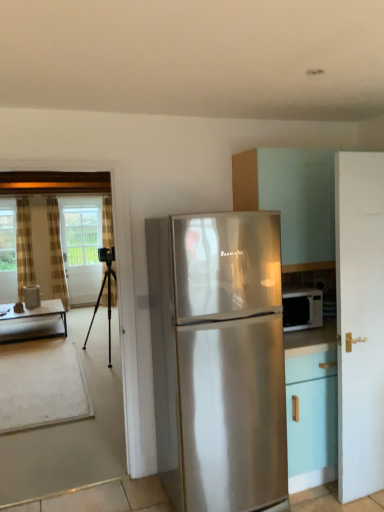
What do you see at coordinates (218, 358) in the screenshot? The width and height of the screenshot is (384, 512). I see `satin silver refrigerator at center` at bounding box center [218, 358].

Measure the distance between point (233, 203) and camera.

2.77 meters.

The height and width of the screenshot is (512, 384). Describe the element at coordinates (360, 321) in the screenshot. I see `white matte door at right` at that location.

This screenshot has height=512, width=384. I want to click on satin silver refrigerator at center, so point(218,358).

Looking at this image, in terms of width, does white glossy water at left look wider or thinner when compared to plaid fabric curtain at left, which ranks as the third curtain in left-to-right order?

Clearly, white glossy water at left has more width compared to plaid fabric curtain at left, which ranks as the third curtain in left-to-right order.

Consider the image. From a real-world perspective, between white glossy water at left and plaid fabric curtain at left, which ranks as the third curtain in left-to-right order, who is vertically higher?

From a 3D spatial view, plaid fabric curtain at left, which ranks as the third curtain in left-to-right order, is above.

Which of these two, white glossy water at left or plaid fabric curtain at left, which ranks as the third curtain in left-to-right order, is smaller?

white glossy water at left is smaller.

Locate an element on the screen. the 1st curtain above the white glossy water at left (from the image's perspective) is located at coordinates tap(107, 223).

Does wooden table at left have a larger size compared to black glossy microwave oven at right?

Yes, wooden table at left is bigger than black glossy microwave oven at right.

Could black glossy microwave oven at right be considered to be inside wooden table at left?

No, black glossy microwave oven at right is not a part of wooden table at left.

Is wooden table at left thinner than black glossy microwave oven at right?

In fact, wooden table at left might be wider than black glossy microwave oven at right.

From the image's perspective, does wooden table at left appear higher than black glossy microwave oven at right?

No.

Is black metal tripod at left beside black glossy microwave oven at right?

No, black metal tripod at left is not in contact with black glossy microwave oven at right.

Does point (110, 306) appear closer or farther from the camera than point (293, 296)?

Point (110, 306).

Between black metal tripod at left and black glossy microwave oven at right, which one has less height?

With less height is black glossy microwave oven at right.

Based on their positions, is black metal tripod at left located to the left or right of black glossy microwave oven at right?

Based on their positions, black metal tripod at left is located to the left of black glossy microwave oven at right.

Which of these two, white glass screen door at left or wooden table at left, stands shorter?

With less height is wooden table at left.

Is white glass screen door at left oriented away from wooden table at left?

No, white glass screen door at left is not facing away from wooden table at left.

From a real-world perspective, is white glass screen door at left physically located above or below wooden table at left?

white glass screen door at left is situated higher than wooden table at left in the real world.

Considering the relative positions of white glass screen door at left and wooden table at left in the image provided, is white glass screen door at left behind wooden table at left?

Yes, white glass screen door at left is further from the viewer.

Between white glass screen door at left and satin silver refrigerator at center, which one has smaller width?

Thinner between the two is white glass screen door at left.

Are white glass screen door at left and satin silver refrigerator at center located far from each other?

Yes.

In the scene shown: Visually, is white glass screen door at left positioned to the left or to the right of satin silver refrigerator at center?

In the image, white glass screen door at left appears on the left side of satin silver refrigerator at center.

Considering the sizes of objects white glass screen door at left and satin silver refrigerator at center in the image provided, who is taller, white glass screen door at left or satin silver refrigerator at center?

white glass screen door at left is taller.

Does point (290, 303) lie in front of point (114, 300)?

Yes, it is in front of point (114, 300).

Based on the photo, which object is wider, black glossy microwave oven at right or plaid fabric curtain at left, the first curtain positioned from the right?

Wider between the two is black glossy microwave oven at right.

Is black glossy microwave oven at right not within plaid fabric curtain at left, which ranks as the third curtain in left-to-right order?

That's correct, black glossy microwave oven at right is outside of plaid fabric curtain at left, which ranks as the third curtain in left-to-right order.

Are black glossy microwave oven at right and plaid fabric curtain at left, which ranks as the third curtain in left-to-right order, beside each other?

No, black glossy microwave oven at right is not with plaid fabric curtain at left, which ranks as the third curtain in left-to-right order.

Is point (43, 320) farther from camera compared to point (252, 202)?

Yes, point (43, 320) is behind point (252, 202).

Is wooden table at left turned away from white glossy cabinet at upper right?

wooden table at left is not turned away from white glossy cabinet at upper right.

Find the location of `table lying below the white glossy cabinet at upper right (from the image's perspective)`. table lying below the white glossy cabinet at upper right (from the image's perspective) is located at coordinates (33, 322).

At what (x,y) coordinates should I click in order to perform the action: click on the 1st curtain above the white glossy water at left (from the image's perspective). Please return your answer as a coordinate pair (x, y). The height and width of the screenshot is (512, 384). Looking at the image, I should click on (107, 223).

Where is `table behind the black glossy microwave oven at right`? This screenshot has height=512, width=384. table behind the black glossy microwave oven at right is located at coordinates (33, 322).

Based on their spatial positions, is white matte door at right or white glossy water at left further from black metal tripod at left?

white matte door at right is further to black metal tripod at left.

Estimate the real-world distances between objects in this image. Which object is further from white glossy water at left, white glossy cabinet at upper right or satin silver refrigerator at center?

white glossy cabinet at upper right.

When comparing their distances from plaid fabric curtain at left, the first curtain positioned from the right, does striped fabric curtain at left, acting as the first curtain starting from the left, or white matte door at right seem closer?

striped fabric curtain at left, acting as the first curtain starting from the left.

Which object lies further to the anchor point white glossy water at left, black glossy microwave oven at right or white matte door at right?

white matte door at right.

Looking at the image, which one is located closer to white glossy cabinet at upper right, plaid fabric curtain at left, the first curtain positioned from the right, or striped fabric curtain at left, which is the third curtain in right-to-left order?

plaid fabric curtain at left, the first curtain positioned from the right.

Estimate the real-world distances between objects in this image. Which object is closer to white matte door at right, white glossy water at left or striped fabric curtain at left, acting as the first curtain starting from the left?

white glossy water at left is positioned closer to the anchor white matte door at right.

Based on their spatial positions, is striped fabric curtain at left, which is the third curtain in right-to-left order, or wooden table at left closer to black metal tripod at left?

Based on the image, wooden table at left appears to be nearer to black metal tripod at left.

From the image, which object appears to be farther from satin silver refrigerator at center, white matte door at right or white glass screen door at left?

white glass screen door at left is positioned further to the anchor satin silver refrigerator at center.

The height and width of the screenshot is (512, 384). What are the coordinates of `appliance between black metal tripod at left and plaid fabric curtain at left, the first curtain positioned from the right, along the z-axis` in the screenshot? It's located at (32, 296).

Identify the location of table between black metal tripod at left and striped fabric curtain at left, acting as the first curtain starting from the left, from front to back. The height and width of the screenshot is (512, 384). (33, 322).

At what (x,y) coordinates should I click in order to perform the action: click on table between white matte door at right and white glass screen door at left along the z-axis. Please return your answer as a coordinate pair (x, y). Looking at the image, I should click on (33, 322).

Where is `table positioned between satin silver refrigerator at center and white glass screen door at left from near to far`? The width and height of the screenshot is (384, 512). table positioned between satin silver refrigerator at center and white glass screen door at left from near to far is located at coordinates (33, 322).